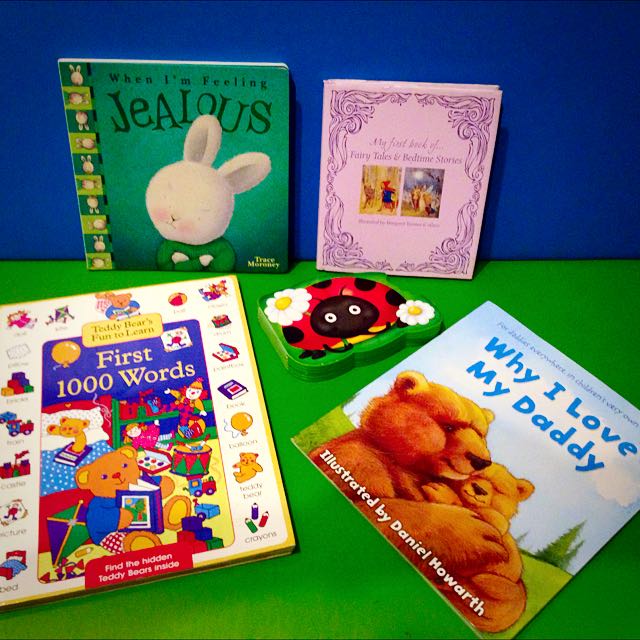
Identify the location of book, my first book of fairy tales and bedtime stories. The image size is (640, 640). (411, 120).